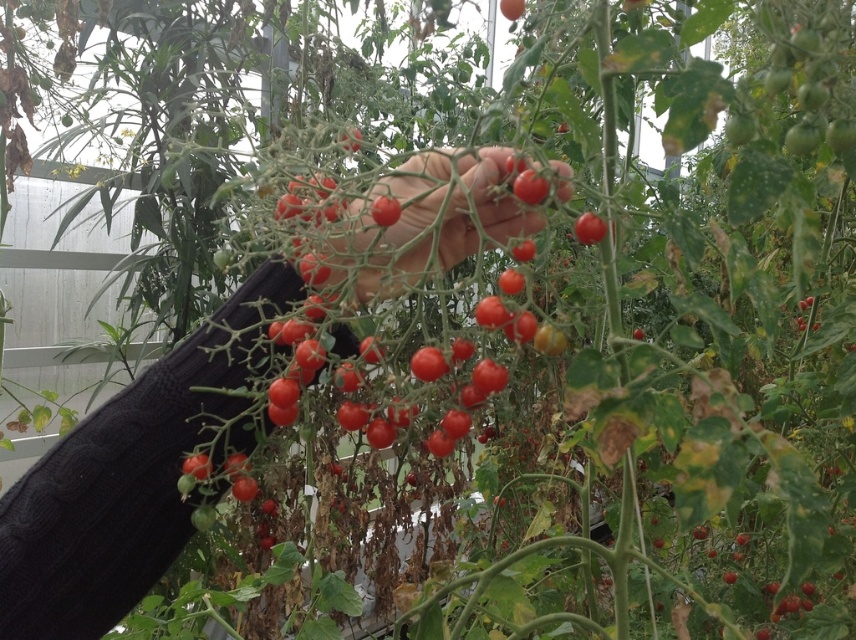
Question: Which object is the closest to the smooth skin hand at center?

Choices:
 (A) glossy red tomato at center
 (B) cable-knit sweater at center

Answer: (A)

Question: Which object is the farthest from the glossy red tomato at center?

Choices:
 (A) smooth skin hand at center
 (B) cable-knit sweater at center

Answer: (B)

Question: Which point is farther from the camera taking this photo?

Choices:
 (A) (488, 168)
 (B) (605, 225)
 (C) (383, 195)

Answer: (A)

Question: Can you confirm if smooth skin hand at center is positioned above glossy red tomato at center?

Choices:
 (A) yes
 (B) no

Answer: (A)

Question: Is smooth skin hand at center above glossy red tomato at center?

Choices:
 (A) yes
 (B) no

Answer: (A)

Question: Is cable-knit sweater at center positioned in front of smooth skin hand at center?

Choices:
 (A) yes
 (B) no

Answer: (B)